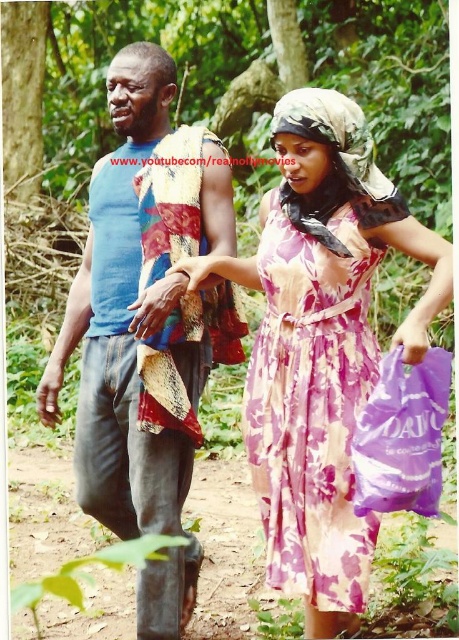
Between matte fabric hand at center and purple fabric bag at lower right, which one has less height?

With less height is matte fabric hand at center.

Measure the distance between point (203, 257) and camera.

The distance of point (203, 257) from camera is 10.23 feet.

Is point (168, 268) less distant than point (419, 348)?

No, (168, 268) is behind (419, 348).

At what (x,y) coordinates should I click in order to perform the action: click on matte fabric hand at center. Please return your answer as a coordinate pair (x, y). The width and height of the screenshot is (459, 640). Looking at the image, I should click on (202, 269).

Which is behind, point (351, 541) or point (420, 316)?

Point (351, 541)

Is point (263, 467) in front of point (407, 321)?

No.

Which is behind, point (365, 392) or point (397, 339)?

Point (365, 392)

Locate an element on the screen. This screenshot has height=640, width=459. floral chiffon dress at center is located at coordinates (312, 406).

Does floral chiffon dress at center appear on the right side of purple plastic bag at lower right?

Incorrect, floral chiffon dress at center is not on the right side of purple plastic bag at lower right.

The image size is (459, 640). What are the coordinates of `floral chiffon dress at center` in the screenshot? It's located at (312, 406).

The image size is (459, 640). What are the coordinates of `floral chiffon dress at center` in the screenshot? It's located at (312, 406).